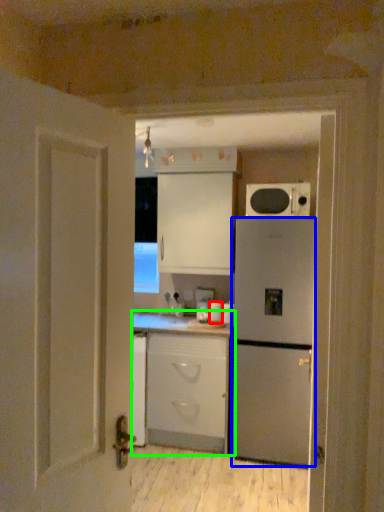
Question: Considering the real-world distances, which object is closest to appliance (highlighted by a red box)? refrigerator (highlighted by a blue box) or cabinetry (highlighted by a green box).

Choices:
 (A) refrigerator
 (B) cabinetry

Answer: (B)